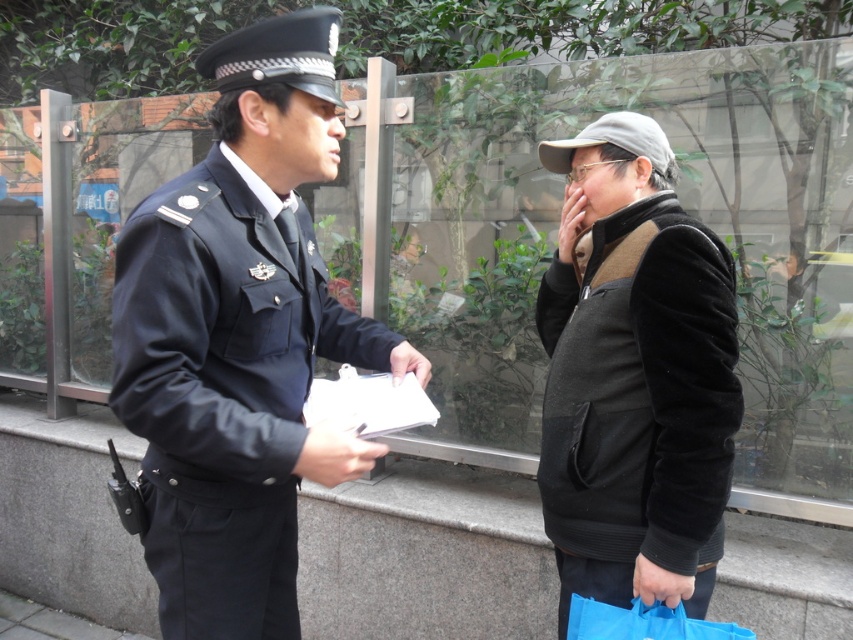
Can you confirm if matte black uniform at center is positioned below velvet black vest at right?

Incorrect, matte black uniform at center is not positioned below velvet black vest at right.

Does point (254, 532) come farther from viewer compared to point (670, 483)?

That is True.

Where is `matte black uniform at center`? matte black uniform at center is located at coordinates (239, 339).